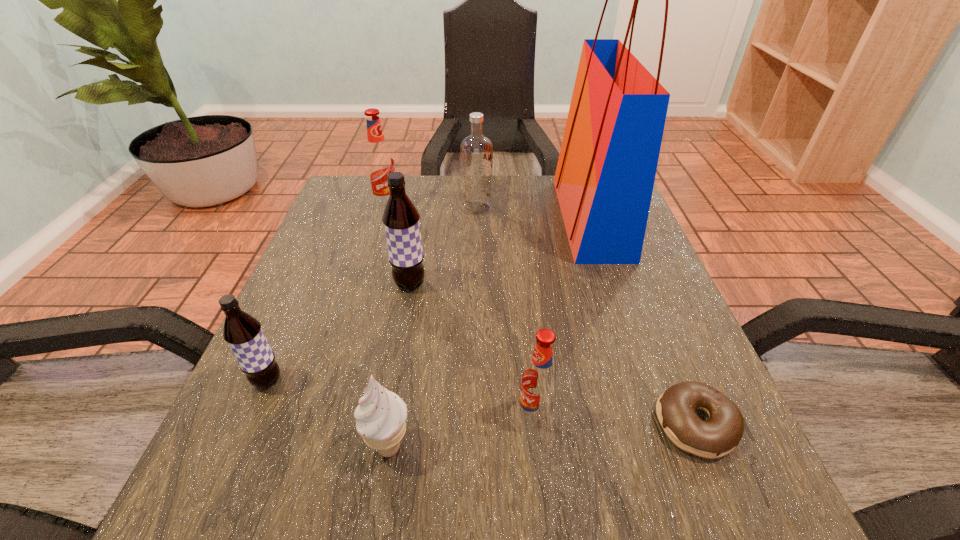
Locate which root beer ranks second in proximity to the doughnut. Please provide its 2D coordinates. Your answer should be formatted as a tuple, i.e. [(x, y)], where the tuple contains the x and y coordinates of a point satisfying the conditions above.

[(401, 221)]

Locate an element on the screen. free spot that satisfies the following two spatial constraints: 1. on the front side of the smaller red root beer; 2. on the left side of the smaller brown root beer is located at coordinates (252, 416).